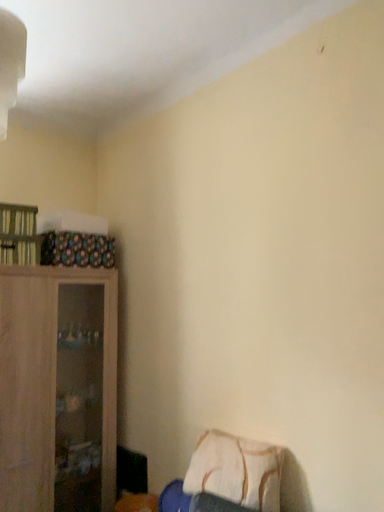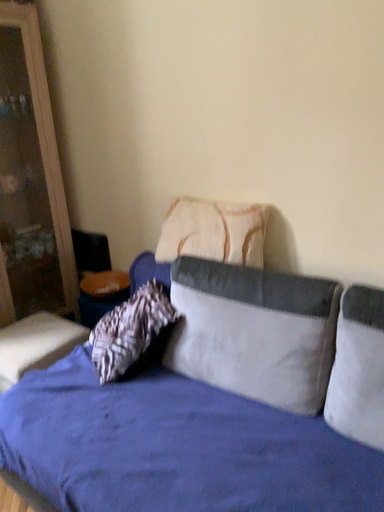
Question: Which way did the camera rotate in the video?

Choices:
 (A) rotated upward
 (B) rotated downward

Answer: (B)